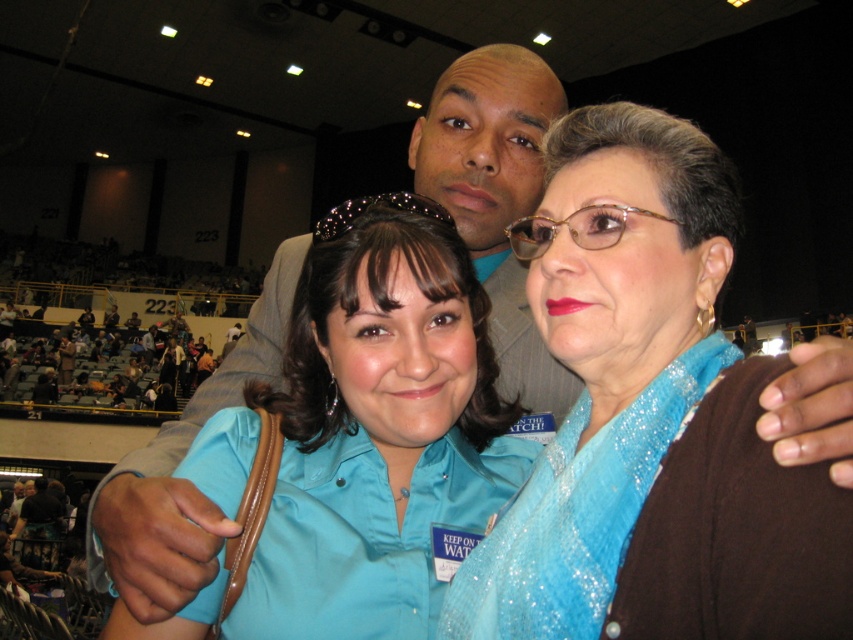
Question: Considering the relative positions of sparkly blue scarf at center and matte blue shirt at center in the image provided, where is sparkly blue scarf at center located with respect to matte blue shirt at center?

Choices:
 (A) left
 (B) right

Answer: (B)

Question: Does sparkly blue scarf at center have a lesser width compared to matte blue shirt at center?

Choices:
 (A) yes
 (B) no

Answer: (A)

Question: Is sparkly blue scarf at center to the left of matte blue shirt at center from the viewer's perspective?

Choices:
 (A) no
 (B) yes

Answer: (A)

Question: Which object is closer to the camera taking this photo?

Choices:
 (A) sparkly blue scarf at center
 (B) matte blue shirt at center

Answer: (A)